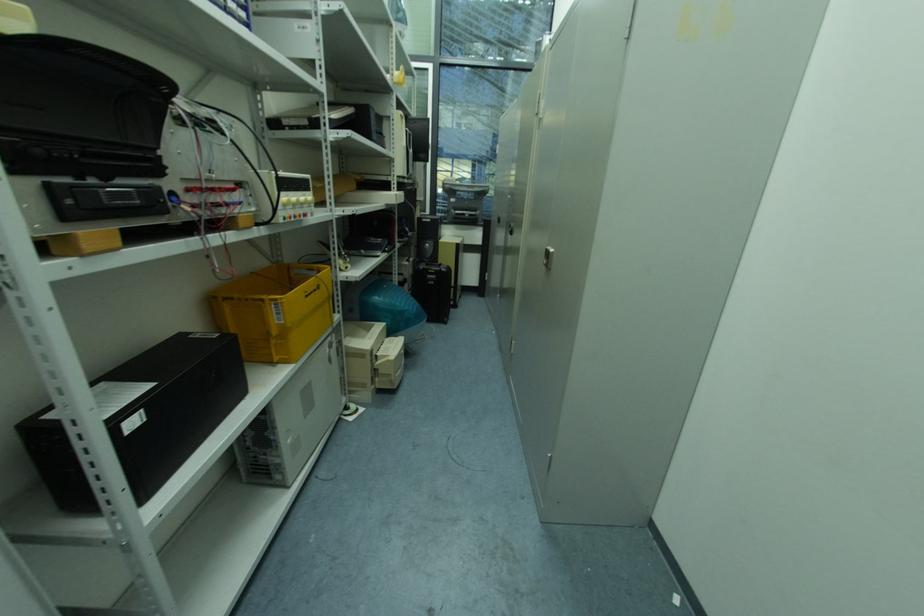
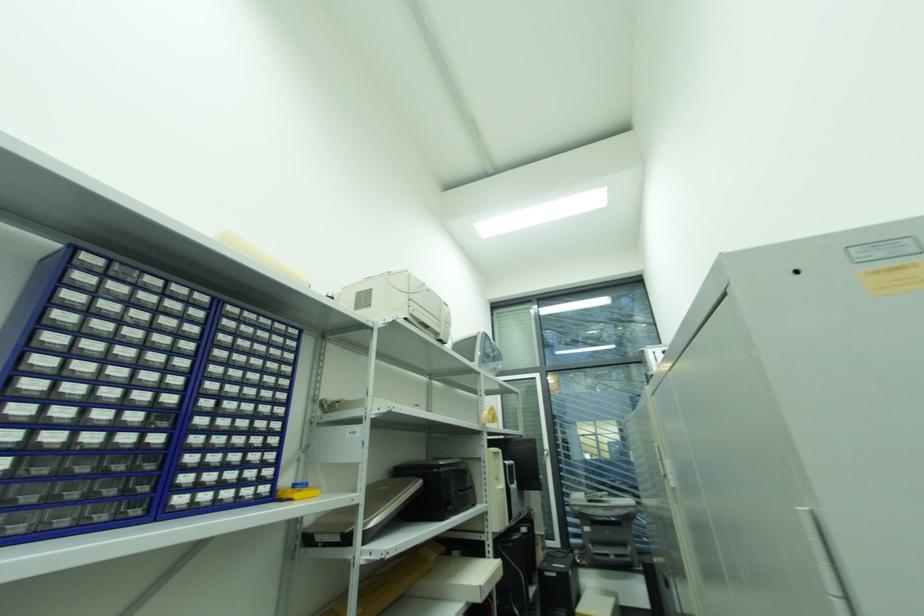
Based on the photo, how did the camera likely rotate?

The camera's rotation is toward left-up.